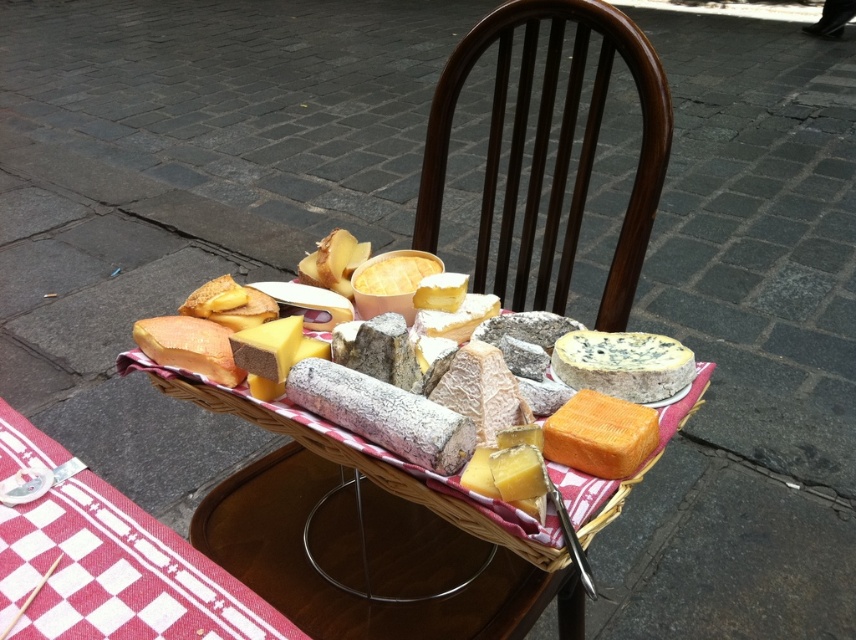
Question: Does red checkered fabric at lower left have a larger size compared to woven wicker basket at center?

Choices:
 (A) yes
 (B) no

Answer: (B)

Question: Among these points, which one is nearest to the camera?

Choices:
 (A) (629, 29)
 (B) (632, 454)

Answer: (B)

Question: Can you confirm if red checkered fabric at lower left is smaller than woven wicker basket at center?

Choices:
 (A) yes
 (B) no

Answer: (A)

Question: Which of the following is the closest to the observer?

Choices:
 (A) blue veined cheese at center
 (B) red checkered fabric at lower left

Answer: (B)

Question: Among these points, which one is farthest from the camera?

Choices:
 (A) (657, 380)
 (B) (506, 177)
 (C) (36, 552)

Answer: (B)

Question: Does dark brown wood chair at center come in front of red checkered fabric at lower left?

Choices:
 (A) no
 (B) yes

Answer: (A)